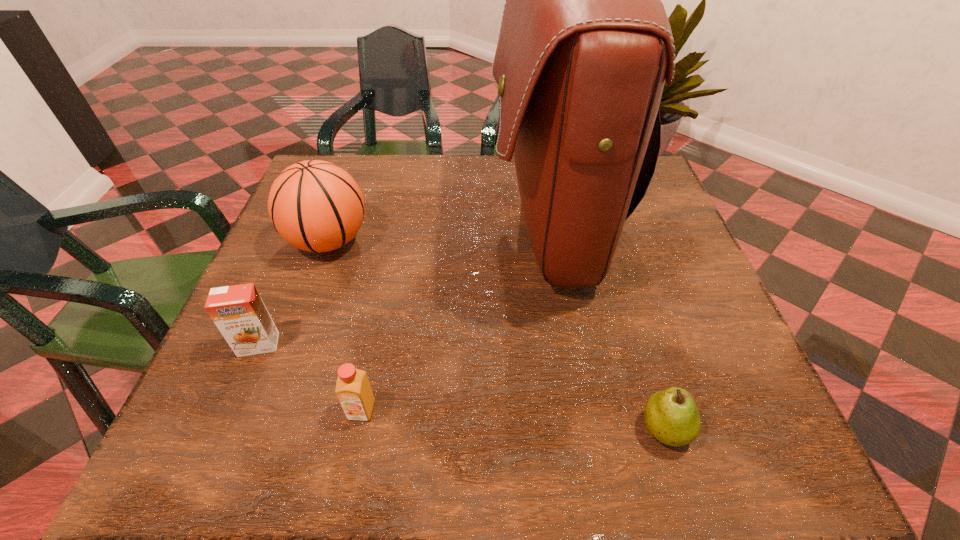
Where is `free area in between the pear and the third object from right to left`? The height and width of the screenshot is (540, 960). free area in between the pear and the third object from right to left is located at coordinates (513, 420).

You are a GUI agent. You are given a task and a screenshot of the screen. Output one action in this format:
    pyautogui.click(x=<x>, y=<y>)
    Task: Click on the free spot between the pear and the shorter orange juice
    
    Given the screenshot: What is the action you would take?
    pyautogui.click(x=513, y=420)

Identify the location of vacant area that lies between the third farthest object and the pear. The image size is (960, 540). (462, 387).

At what (x,y) coordinates should I click in order to perform the action: click on vacant area that lies between the second tallest object and the third nearest object. Please return your answer as a coordinate pair (x, y). The image size is (960, 540). Looking at the image, I should click on (294, 293).

The image size is (960, 540). In order to click on free space between the farther orange juice and the pear in this screenshot , I will do `click(462, 387)`.

Where is `vacant space that's between the pear and the shorter orange juice`? The width and height of the screenshot is (960, 540). vacant space that's between the pear and the shorter orange juice is located at coordinates (513, 420).

Find the location of `vacant region between the pear and the right orange juice`. vacant region between the pear and the right orange juice is located at coordinates (513, 420).

You are a GUI agent. You are given a task and a screenshot of the screen. Output one action in this format:
    pyautogui.click(x=<x>, y=<y>)
    Task: Click on the free space between the basketball and the pear
    This screenshot has height=540, width=960.
    Given the screenshot: What is the action you would take?
    pyautogui.click(x=496, y=335)

Where is `free space that is in between the tallest object and the pear`? free space that is in between the tallest object and the pear is located at coordinates (607, 326).

Find the location of a particular element. This screenshot has height=540, width=960. object that is the second closest to the farther orange juice is located at coordinates pos(353,390).